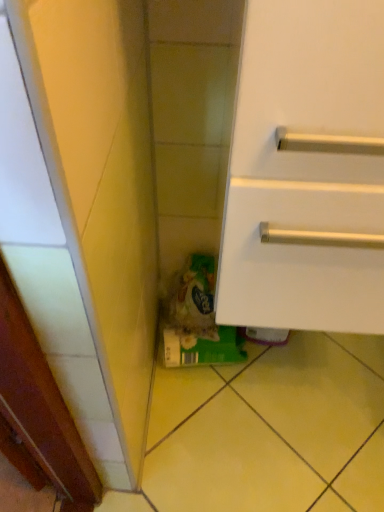
At what (x,y) coordinates should I click in order to perform the action: click on green plastic bag at lower center. Please return your answer as a coordinate pair (x, y). Looking at the image, I should click on (196, 319).

What do you see at coordinates (196, 319) in the screenshot?
I see `green plastic bag at lower center` at bounding box center [196, 319].

The height and width of the screenshot is (512, 384). What do you see at coordinates (307, 170) in the screenshot?
I see `white matte cabinet at lower right` at bounding box center [307, 170].

Where is `white matte cabinet at lower right`? white matte cabinet at lower right is located at coordinates (307, 170).

The height and width of the screenshot is (512, 384). What are the coordinates of `green plastic bag at lower center` in the screenshot? It's located at (196, 319).

Can you confirm if green plastic bag at lower center is positioned to the right of white matte cabinet at lower right?

No.

Is green plastic bag at lower center in front of or behind white matte cabinet at lower right in the image?

In the image, green plastic bag at lower center appears behind white matte cabinet at lower right.

Considering the points (184, 300) and (380, 45), which point is in front, point (184, 300) or point (380, 45)?

The point (380, 45) is closer.

From the image's perspective, is green plastic bag at lower center located above or below white matte cabinet at lower right?

From the image's perspective, green plastic bag at lower center appears below white matte cabinet at lower right.

From a real-world perspective, is green plastic bag at lower center below white matte cabinet at lower right?

Yes, from a real-world perspective, green plastic bag at lower center is below white matte cabinet at lower right.

Considering the sizes of objects green plastic bag at lower center and white matte cabinet at lower right in the image provided, who is thinner, green plastic bag at lower center or white matte cabinet at lower right?

green plastic bag at lower center is thinner.

In the scene shown: Can you confirm if green plastic bag at lower center is shorter than white matte cabinet at lower right?

Yes, green plastic bag at lower center is shorter than white matte cabinet at lower right.

Can you confirm if green plastic bag at lower center is bigger than white matte cabinet at lower right?

No.

Is white matte cabinet at lower right inside green plastic bag at lower center?

No, white matte cabinet at lower right is not a part of green plastic bag at lower center.

Is green plastic bag at lower center not close to white matte cabinet at lower right?

That's not correct — green plastic bag at lower center is a little close to white matte cabinet at lower right.

Is green plastic bag at lower center aimed at white matte cabinet at lower right?

No, green plastic bag at lower center is not facing towards white matte cabinet at lower right.

Find the location of a particular element. garbage beneath the white matte cabinet at lower right (from a real-world perspective) is located at coordinates (196, 319).

Between white matte cabinet at lower right and green plastic bag at lower center, which one appears on the right side from the viewer's perspective?

white matte cabinet at lower right.

Considering the relative positions of white matte cabinet at lower right and green plastic bag at lower center in the image provided, is white matte cabinet at lower right in front of green plastic bag at lower center?

Yes, it is.

Is point (292, 139) closer or farther from the camera than point (175, 322)?

Point (292, 139) is positioned closer to the camera compared to point (175, 322).

From the image's perspective, is white matte cabinet at lower right on green plastic bag at lower center?

Indeed, from the image's perspective, white matte cabinet at lower right is shown above green plastic bag at lower center.

From a real-world perspective, who is located higher, white matte cabinet at lower right or green plastic bag at lower center?

In real-world perspective, white matte cabinet at lower right is above.

Considering the sizes of objects white matte cabinet at lower right and green plastic bag at lower center in the image provided, who is wider, white matte cabinet at lower right or green plastic bag at lower center?

white matte cabinet at lower right is wider.

Considering the sizes of objects white matte cabinet at lower right and green plastic bag at lower center in the image provided, who is taller, white matte cabinet at lower right or green plastic bag at lower center?

white matte cabinet at lower right is taller.

Looking at this image, does white matte cabinet at lower right have a smaller size compared to green plastic bag at lower center?

No, white matte cabinet at lower right is not smaller than green plastic bag at lower center.

Do you think white matte cabinet at lower right is within green plastic bag at lower center, or outside of it?

white matte cabinet at lower right is outside green plastic bag at lower center.

Are white matte cabinet at lower right and green plastic bag at lower center beside each other?

No, white matte cabinet at lower right is not beside green plastic bag at lower center.

Is white matte cabinet at lower right facing towards green plastic bag at lower center?

No, white matte cabinet at lower right is not facing towards green plastic bag at lower center.

How different are the orientations of white matte cabinet at lower right and green plastic bag at lower center in degrees?

4.16 degrees separate the facing orientations of white matte cabinet at lower right and green plastic bag at lower center.

Where is `cabinetry above the green plastic bag at lower center (from a real-world perspective)`? cabinetry above the green plastic bag at lower center (from a real-world perspective) is located at coordinates (307, 170).

You are a GUI agent. You are given a task and a screenshot of the screen. Output one action in this format:
    pyautogui.click(x=<x>, y=<y>)
    Task: Click on the garbage that is behind the white matte cabinet at lower right
    
    Given the screenshot: What is the action you would take?
    pyautogui.click(x=196, y=319)

Where is `cabinetry in front of the green plastic bag at lower center`? cabinetry in front of the green plastic bag at lower center is located at coordinates (307, 170).